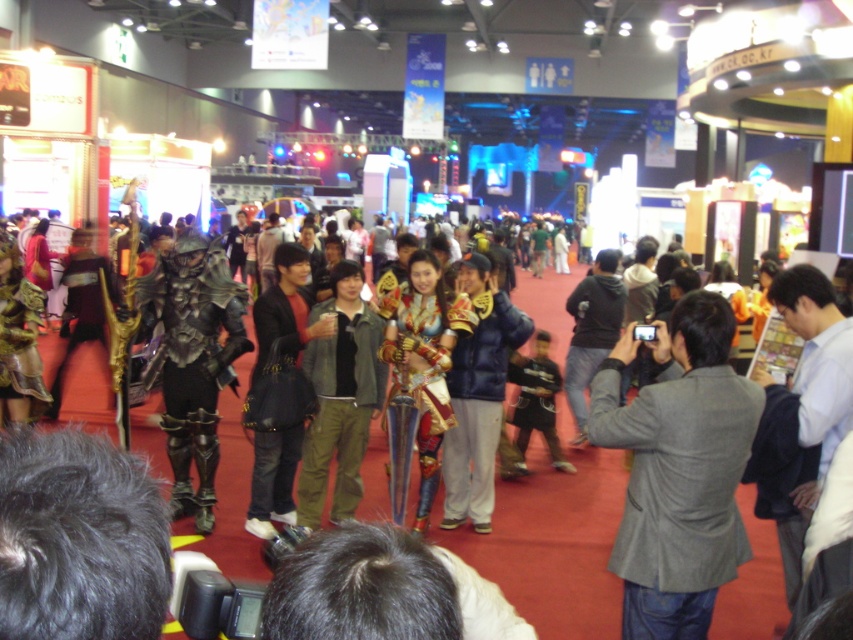
Question: Which is farther from the gold metallic armor at center?

Choices:
 (A) metallic armor at center
 (B) gray wool jacket at center
 (C) black leather jacket at center

Answer: (B)

Question: Is gray wool jacket at center bigger than black leather jacket at center?

Choices:
 (A) no
 (B) yes

Answer: (A)

Question: Is the position of gold metallic armor at center less distant than that of black leather jacket at center?

Choices:
 (A) no
 (B) yes

Answer: (A)

Question: Estimate the real-world distances between objects in this image. Which object is farther from the gray wool jacket at center?

Choices:
 (A) metallic armor at center
 (B) black leather jacket at center

Answer: (B)

Question: Is shiny metallic armor at center below black leather jacket at center?

Choices:
 (A) yes
 (B) no

Answer: (B)

Question: Which of the following is the farthest from the observer?

Choices:
 (A) gray wool jacket at center
 (B) black leather jacket at center

Answer: (B)